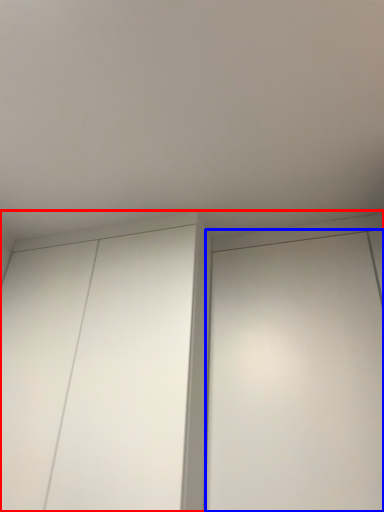
Question: Among these objects, which one is farthest to the camera, cupboard (highlighted by a red box) or elevator (highlighted by a blue box)?

Choices:
 (A) cupboard
 (B) elevator

Answer: (A)